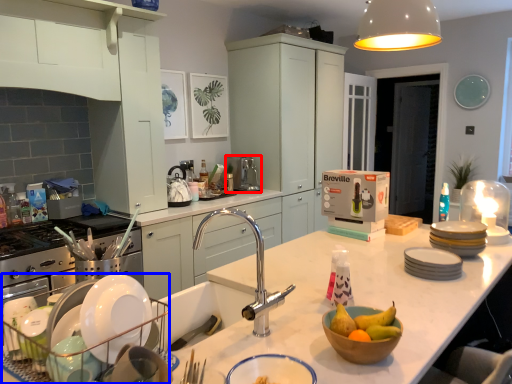
Question: Which point is closer to the camera, kitchen appliance (highlighted by a red box) or appliance (highlighted by a blue box)?

Choices:
 (A) kitchen appliance
 (B) appliance

Answer: (B)